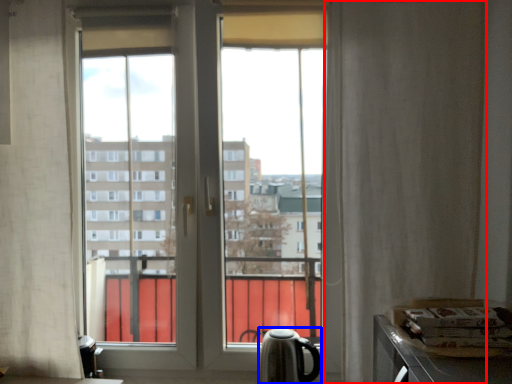
Question: Which object appears farthest to the camera in this image, curtain (highlighted by a red box) or tea pot (highlighted by a blue box)?

Choices:
 (A) curtain
 (B) tea pot

Answer: (B)